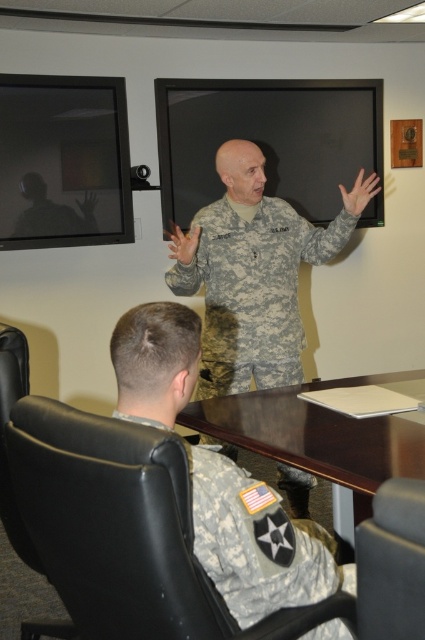
Question: Which object appears farthest from the camera in this image?

Choices:
 (A) black leather chair at lower left
 (B) brown wood table at center
 (C) camouflage fabric uniform at center

Answer: (C)

Question: Which point is closer to the camera?

Choices:
 (A) (232, 253)
 (B) (360, 598)

Answer: (B)

Question: Does black leather chair at lower left appear on the left side of camouflage fabric uniform at center?

Choices:
 (A) yes
 (B) no

Answer: (A)

Question: Is black leather chair at lower left thinner than brown wood table at center?

Choices:
 (A) no
 (B) yes

Answer: (B)

Question: Can you confirm if camouflage fabric uniform at center is bigger than matte black chair at lower right?

Choices:
 (A) yes
 (B) no

Answer: (A)

Question: Which of the following is the farthest from the observer?

Choices:
 (A) (234, 272)
 (B) (394, 538)

Answer: (A)